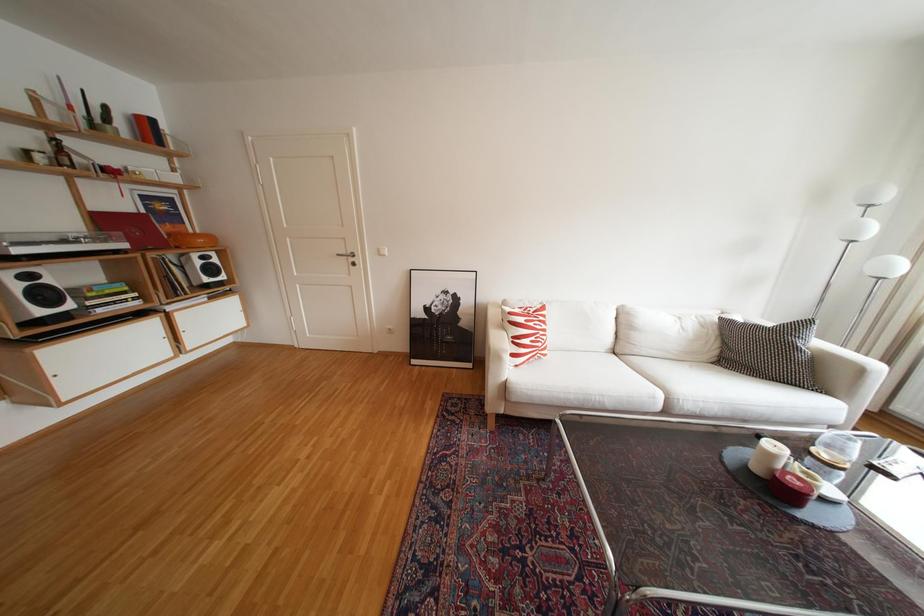
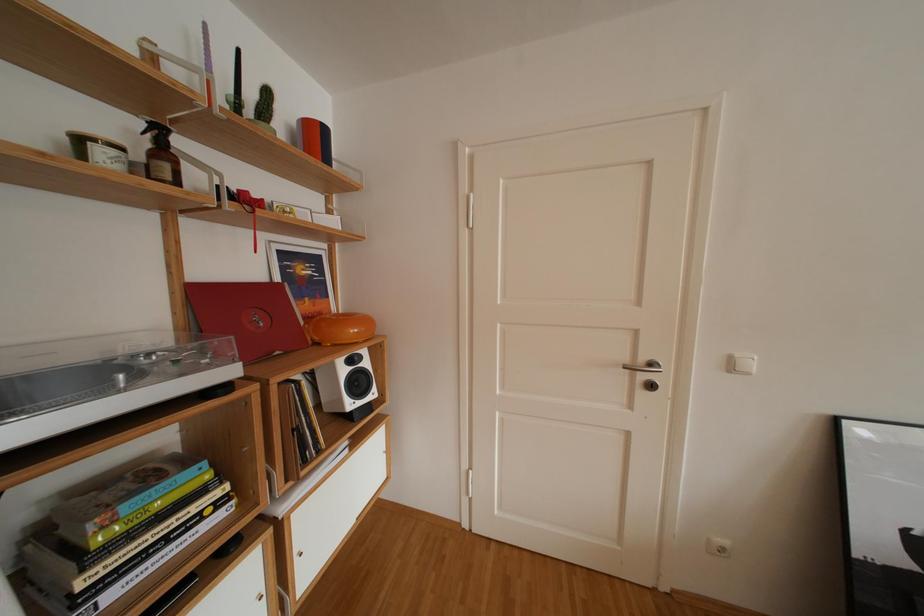
The images are taken continuously from a first-person perspective. In which direction are you moving?

The cameraman walked toward left, forward.